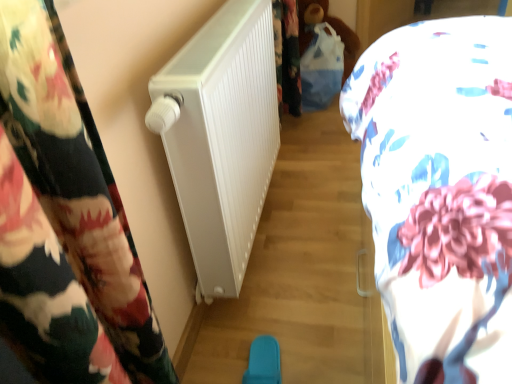
What do you see at coordinates (223, 138) in the screenshot?
I see `white matte radiator at center left` at bounding box center [223, 138].

What is the approximate width of white matte radiator at center left?

It is 4.83 inches.

This screenshot has width=512, height=384. Find the location of `white matte radiator at center left`. white matte radiator at center left is located at coordinates (223, 138).

Measure the distance between point (242, 60) and camera.

Point (242, 60) is 3.50 feet from camera.

Where is `white matte radiator at center left`? This screenshot has width=512, height=384. white matte radiator at center left is located at coordinates (223, 138).